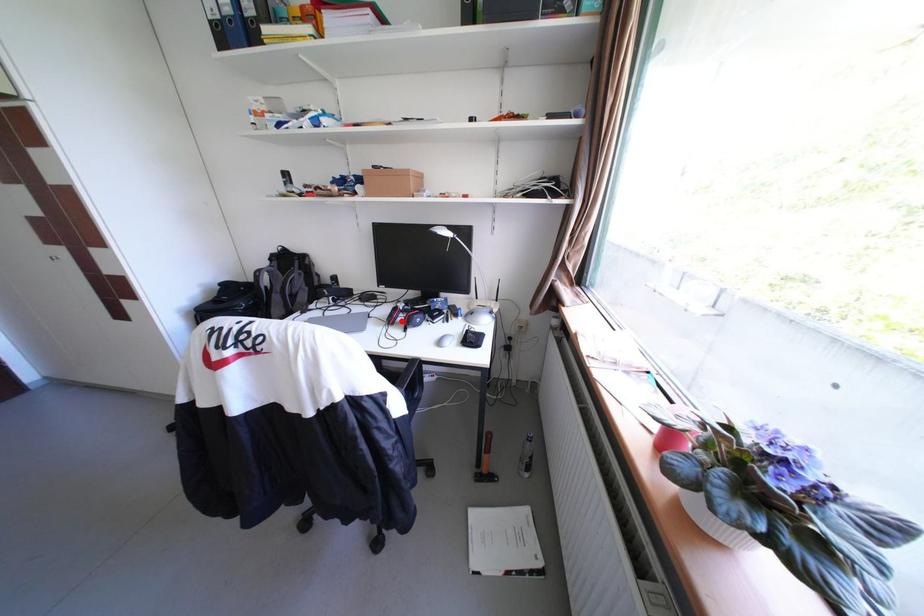
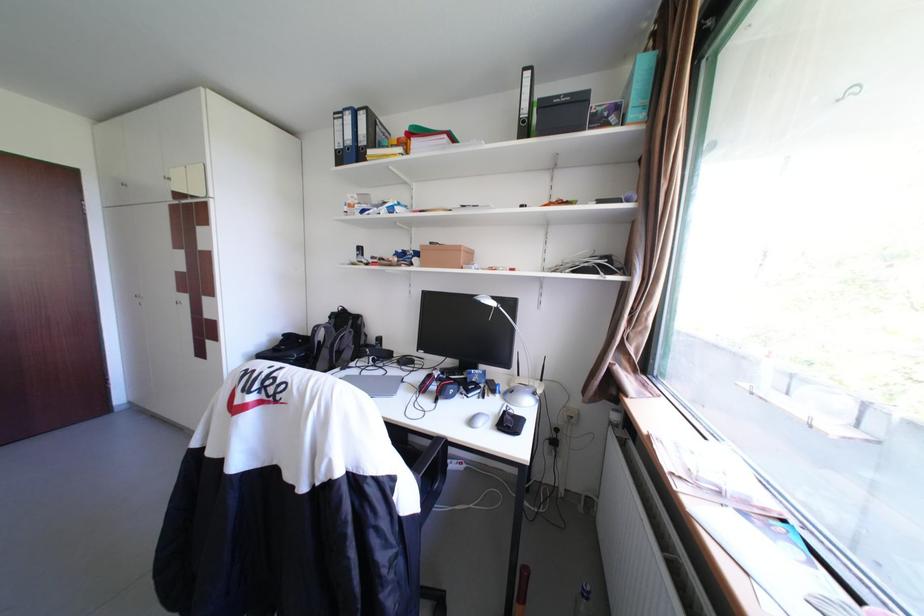
In the second image, find the point that corresponds to the highlighted location in the first image.

(433, 389)